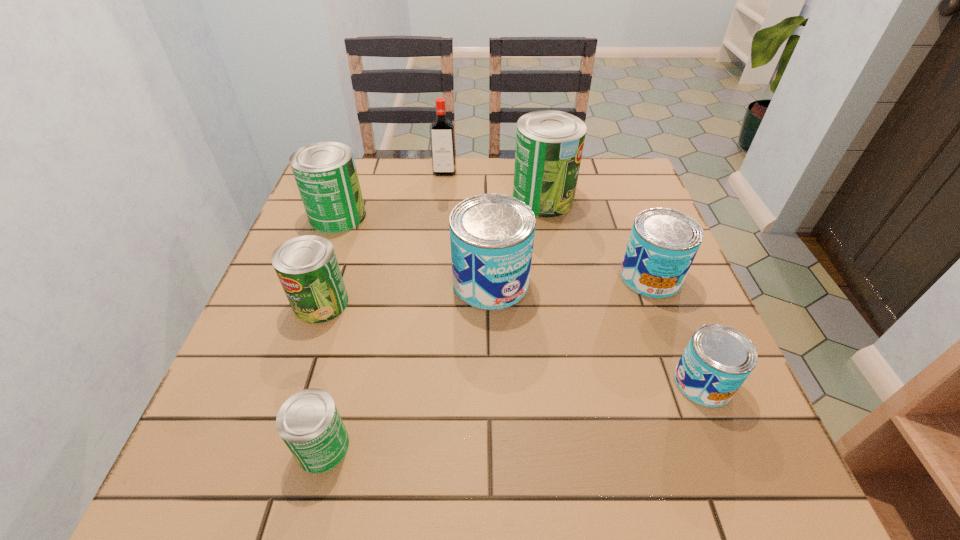
The height and width of the screenshot is (540, 960). I want to click on unoccupied position between the biggest blue can and the third smallest green can, so click(415, 249).

Image resolution: width=960 pixels, height=540 pixels. I want to click on vacant space in between the red vodka and the second biggest green can, so click(392, 195).

This screenshot has width=960, height=540. Find the location of `unoccupied position between the nearest object and the biggest blue can`. unoccupied position between the nearest object and the biggest blue can is located at coordinates (407, 364).

Find the location of a particular element. free spot between the nearest green can and the tallest can is located at coordinates (433, 322).

Find the location of a particular element. free space between the nearest green can and the biggest blue can is located at coordinates (407, 364).

Point out which object is positioned as the fifth nearest to the vodka. Please provide its 2D coordinates. Your answer should be formatted as a tuple, i.e. [(x, y)], where the tuple contains the x and y coordinates of a point satisfying the conditions above.

[(663, 243)]

Locate an element on the screen. object that stands as the second closest to the leftmost blue can is located at coordinates (663, 243).

At what (x,y) coordinates should I click in order to perform the action: click on can object that ranks as the fifth closest to the second biggest blue can. Please return your answer as a coordinate pair (x, y). The height and width of the screenshot is (540, 960). Looking at the image, I should click on (309, 423).

Select which can is the fifth closest to the second biggest green can. Please provide its 2D coordinates. Your answer should be formatted as a tuple, i.e. [(x, y)], where the tuple contains the x and y coordinates of a point satisfying the conditions above.

[(663, 243)]

Identify the location of green can object that ranks as the second closest to the nearest green can. (325, 172).